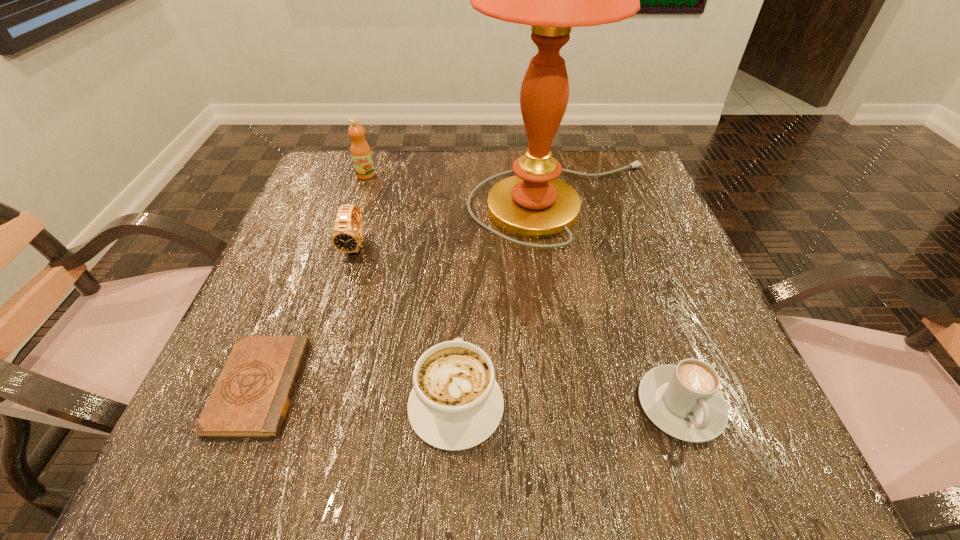
I want to click on the tallest object, so click(x=534, y=204).

At what (x,y) coordinates should I click in order to perform the action: click on orange juice. Please return your answer as a coordinate pair (x, y). Looking at the image, I should click on (361, 155).

At what (x,y) coordinates should I click in order to perform the action: click on watch. Please return your answer as a coordinate pair (x, y). The image size is (960, 540). Looking at the image, I should click on (347, 236).

What are the coordinates of `the left cappuccino` in the screenshot? It's located at (455, 404).

This screenshot has width=960, height=540. I want to click on the shorter cappuccino, so click(x=684, y=400).

Find the location of a particular element. the right cappuccino is located at coordinates (684, 400).

Find the location of a particular element. The width and height of the screenshot is (960, 540). the shortest object is located at coordinates (251, 398).

Find the location of a particular element. This screenshot has height=540, width=960. vacant space positioned 0.340m on the front of the lamp is located at coordinates (611, 410).

I want to click on free spot located on the front label of the orange juice, so click(321, 308).

At what (x,y) coordinates should I click in order to perform the action: click on free spot located 0.340m on the face of the watch. Please return your answer as a coordinate pair (x, y). Looking at the image, I should click on (300, 429).